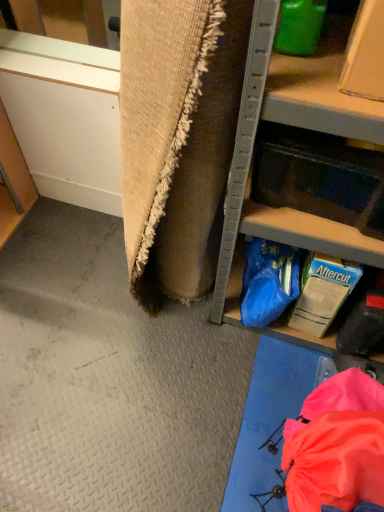
Question: Based on their sizes in the image, would you say metallic gray shelf at right is bigger or smaller than translucent plastic drawer at lower right?

Choices:
 (A) small
 (B) big

Answer: (B)

Question: From a real-world perspective, is metallic gray shelf at right physically located above or below translucent plastic drawer at lower right?

Choices:
 (A) above
 (B) below

Answer: (B)

Question: From their relative heights in the image, would you say metallic gray shelf at right is taller or shorter than translucent plastic drawer at lower right?

Choices:
 (A) short
 (B) tall

Answer: (B)

Question: Is translucent plastic drawer at lower right bigger or smaller than metallic gray shelf at right?

Choices:
 (A) big
 (B) small

Answer: (B)

Question: Is point (264, 183) positioned closer to the camera than point (248, 104)?

Choices:
 (A) farther
 (B) closer

Answer: (A)

Question: Is translucent plastic drawer at lower right spatially inside metallic gray shelf at right, or outside of it?

Choices:
 (A) inside
 (B) outside

Answer: (A)

Question: Is translucent plastic drawer at lower right wider or thinner than metallic gray shelf at right?

Choices:
 (A) wide
 (B) thin

Answer: (B)